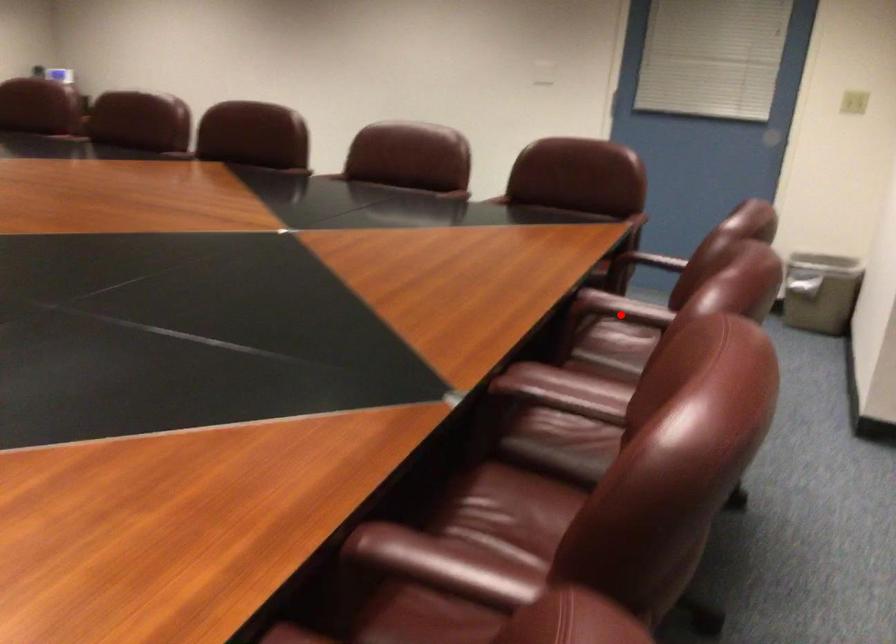
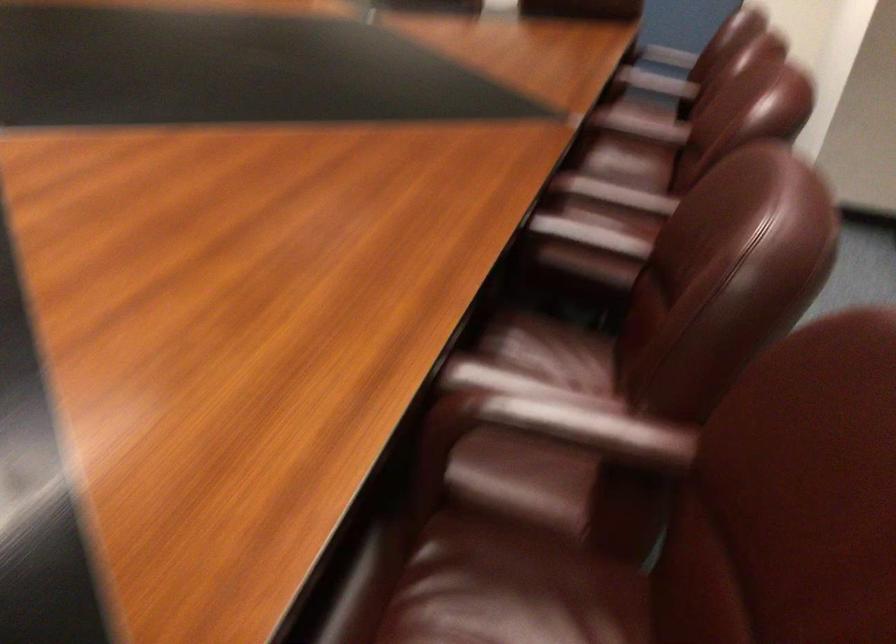
Question: I am providing you with two images of the same scene from different viewpoints. In image1, a red point is highlighted. Considering the same 3D point in image2, which of the following is correct?

Choices:
 (A) It is closer
 (B) It is farther

Answer: (B)